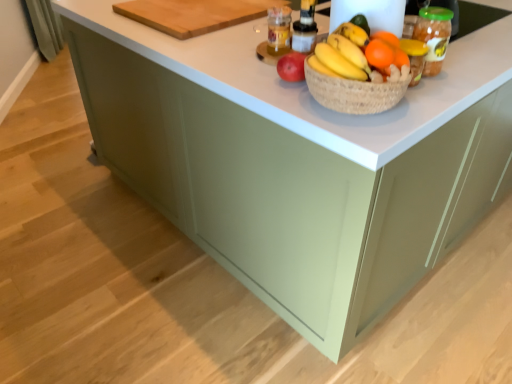
Question: From a real-world perspective, is orange matte at upper right positioned above or below orange matte grapefruit at center?

Choices:
 (A) above
 (B) below

Answer: (B)

Question: From the image's perspective, relative to orange matte grapefruit at center, is orange matte at upper right above or below?

Choices:
 (A) above
 (B) below

Answer: (B)

Question: Which of these objects is positioned farthest from the orange matte grapefruit at center?

Choices:
 (A) translucent plastic bottle at upper center
 (B) wooden cutting board at upper center
 (C) orange matte at upper right

Answer: (B)

Question: Considering the real-world distances, which object is farthest from the translucent plastic bottle at upper center?

Choices:
 (A) orange matte at upper right
 (B) orange matte grapefruit at center
 (C) wooden cutting board at upper center

Answer: (A)